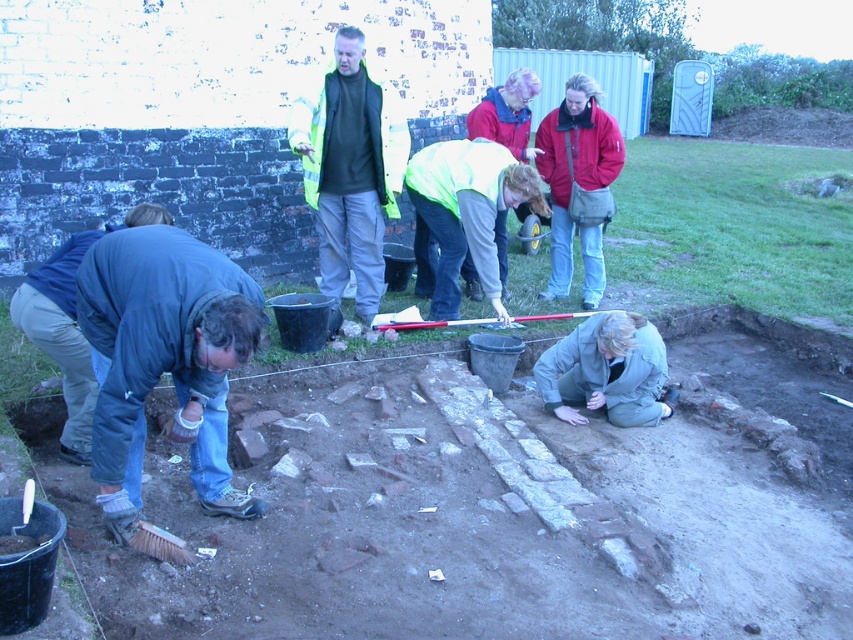
You are a photographer at the archaeological site and want to capture a photo that includes both the light green reflective jacket at center and the khaki fabric jacket at lower right. Which jacket will appear larger in the photo?

The light green reflective jacket at center will appear larger in the photo because it is larger in size than the khaki fabric jacket at lower right.